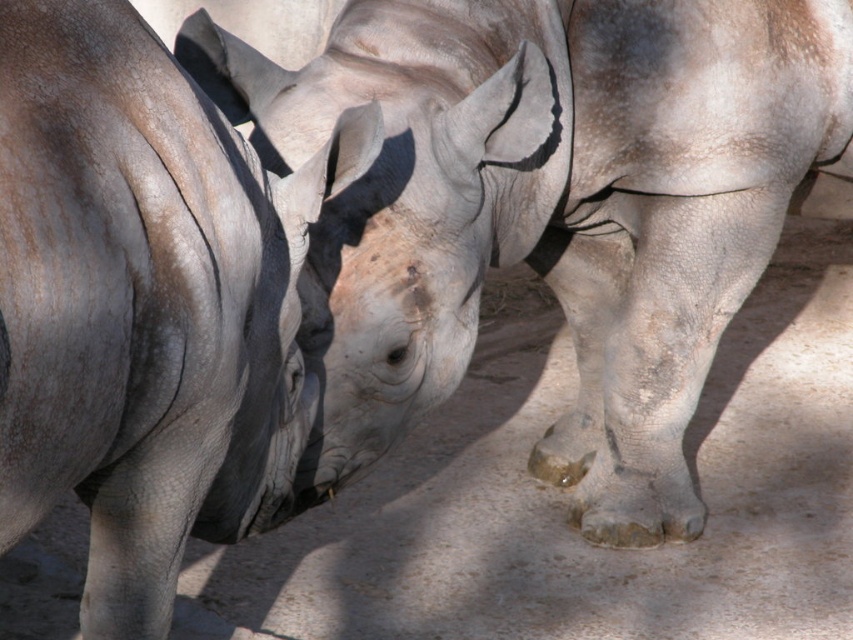
You are a photographer standing at the camera position. You want to take a closeup photo of the rhinoceroses. The camera can focus on objects within 2 meters. Is the point at coordinate point [439,96] within the focus range?

The point at coordinate point [439,96] is 3.21 meters from the camera, which is beyond the 2 meter focus range. The camera cannot focus on that point.

In the scene shown: You are a zookeeper observing two gray rhinos in their enclosure. You notice the gray textured rhino at center and the gray rough skin at center. Which one is more to the right?

The gray textured rhino at center is positioned on the right side of gray rough skin at center, so it is more to the right.

You are a wildlife photographer trying to capture a closeup of the gray textured rhino at center and the gray rough skin at center. Since you want to focus on both subjects, which one should you adjust your camera focus to first considering their height?

The gray textured rhino at center is taller than the gray rough skin at center, so you should focus on the gray textured rhino at center first as it is higher up.